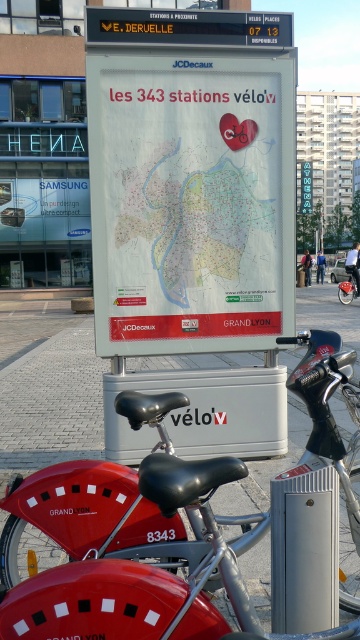
Question: Is white paper map at center in front of metallic silver bicycle at center?

Choices:
 (A) yes
 (B) no

Answer: (A)

Question: Considering the real-world distances, which object is farthest from the metallic silver bicycle at center?

Choices:
 (A) white paper map at center
 (B) brick pavement at lower center

Answer: (A)

Question: Which object is closer to the camera taking this photo?

Choices:
 (A) brick pavement at lower center
 (B) metallic silver bicycle at center
 (C) white paper map at center

Answer: (A)

Question: Is white paper map at center smaller than brick pavement at lower center?

Choices:
 (A) yes
 (B) no

Answer: (A)

Question: Is the position of white paper map at center more distant than that of brick pavement at lower center?

Choices:
 (A) yes
 (B) no

Answer: (A)

Question: Which object is closer to the camera taking this photo?

Choices:
 (A) metallic silver bicycle at center
 (B) white paper map at center
 (C) brick pavement at lower center

Answer: (C)